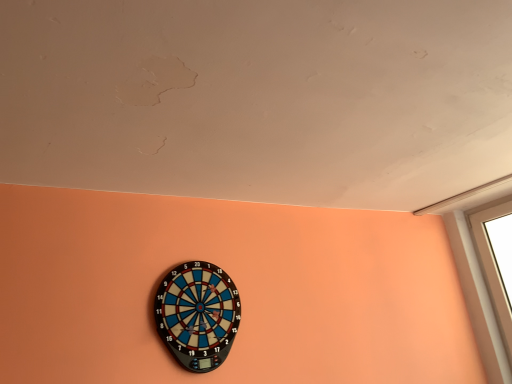
This screenshot has height=384, width=512. Find the location of `blue plastic dartboard at center`. blue plastic dartboard at center is located at coordinates (198, 315).

What do you see at coordinates (198, 315) in the screenshot? I see `blue plastic dartboard at center` at bounding box center [198, 315].

Where is `blue plastic dartboard at center`? This screenshot has height=384, width=512. blue plastic dartboard at center is located at coordinates (198, 315).